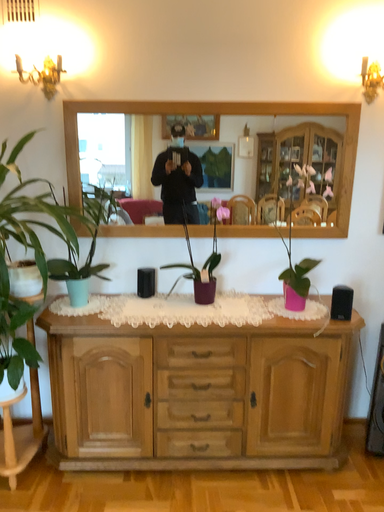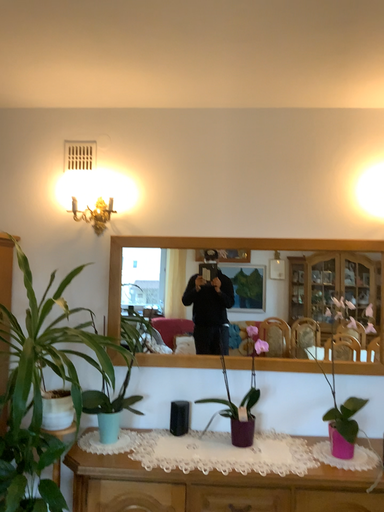
Question: Which way did the camera rotate in the video?

Choices:
 (A) rotated upward
 (B) rotated downward

Answer: (A)